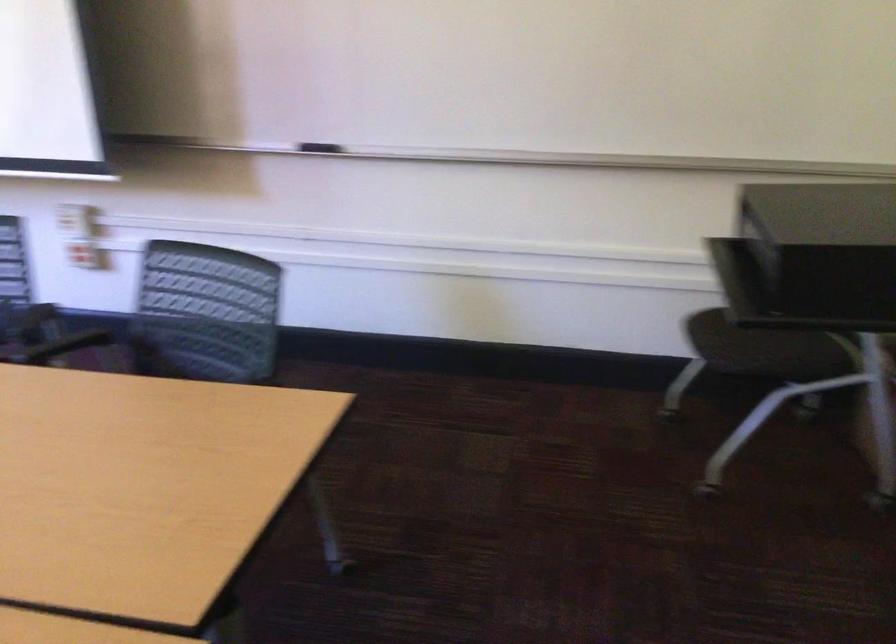
What do you see at coordinates (204, 313) in the screenshot?
I see `the chair sitting surface` at bounding box center [204, 313].